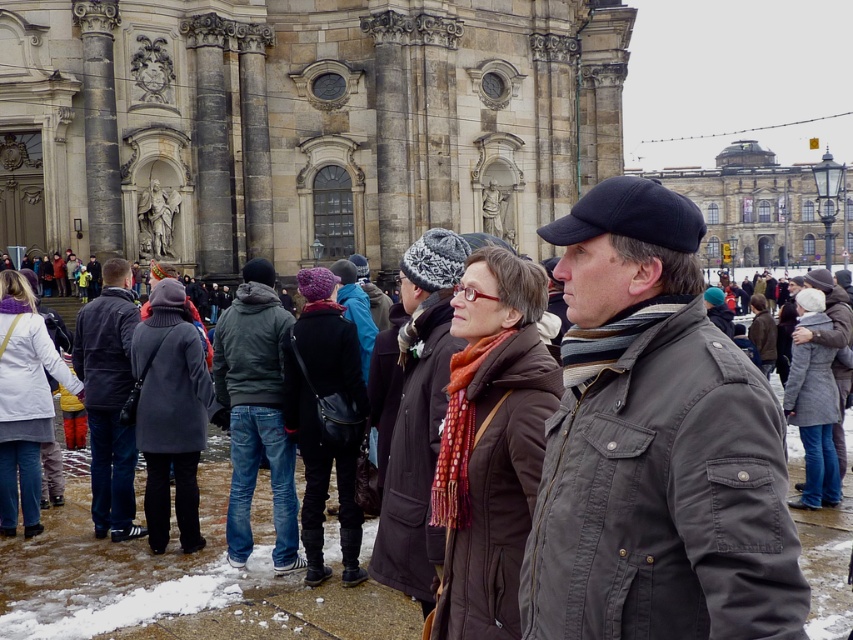
Question: Which object appears closest to the camera in this image?

Choices:
 (A) dark blue jeans at left
 (B) dark gray jacket at center

Answer: (B)

Question: Does brown woolen scarf at center have a greater width compared to brown leather coat at center?

Choices:
 (A) no
 (B) yes

Answer: (A)

Question: Can you confirm if stone textured palace at center is smaller than dark blue jeans at left?

Choices:
 (A) yes
 (B) no

Answer: (B)

Question: Is stone textured palace at center smaller than brown leather coat at center?

Choices:
 (A) yes
 (B) no

Answer: (B)

Question: Among these points, which one is farthest from the camera?

Choices:
 (A) (111, 280)
 (B) (436, 44)

Answer: (B)

Question: Which of the following is the farthest from the observer?

Choices:
 (A) (520, 400)
 (B) (143, 387)

Answer: (B)